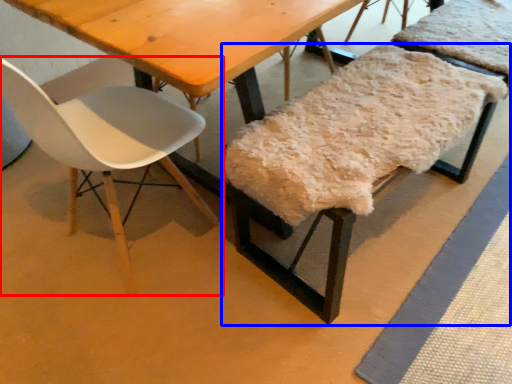
Question: Which point is further to the camera, chair (highlighted by a red box) or chair (highlighted by a blue box)?

Choices:
 (A) chair
 (B) chair

Answer: (B)